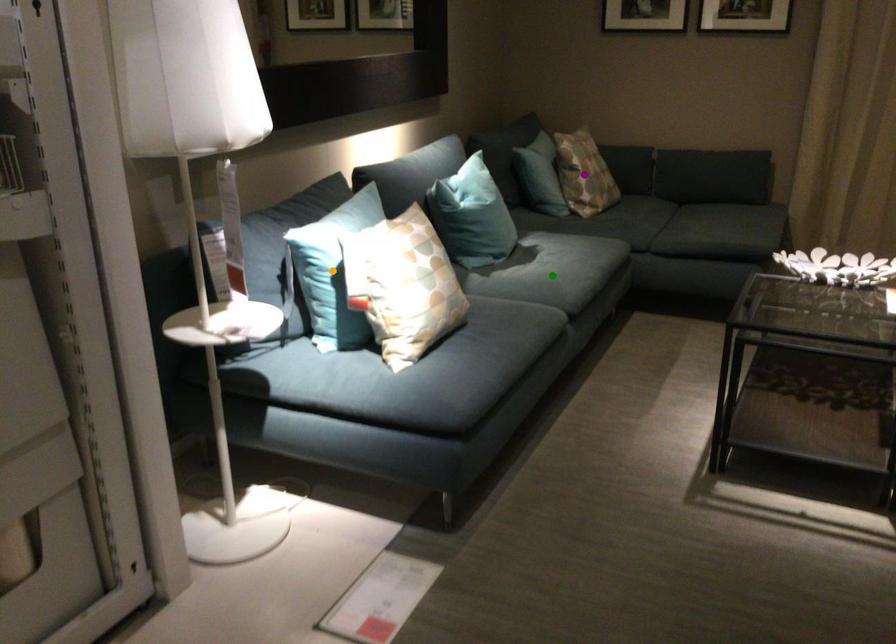
Order these from nearest to farthest:
orange point, green point, purple point

orange point
green point
purple point